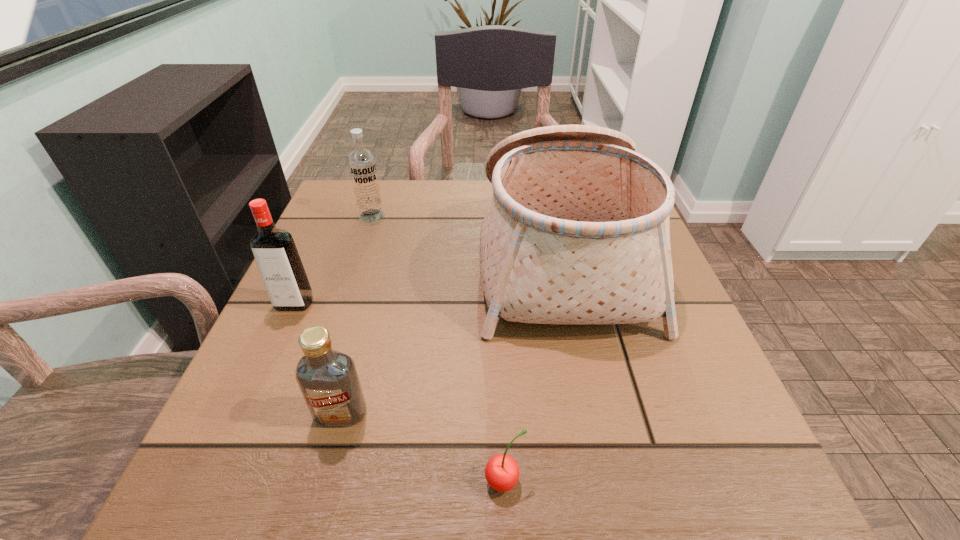
In order to click on free space located 0.060m with the lid open on the tallest object in this screenshot , I will do `click(452, 256)`.

This screenshot has width=960, height=540. I want to click on vacant space located 0.280m on the front and back of the leftmost object, so click(x=226, y=457).

The height and width of the screenshot is (540, 960). I want to click on vacant space located on the front label of the farthest vodka, so click(x=349, y=282).

The width and height of the screenshot is (960, 540). In order to click on free space located on the front-facing side of the second shortest object in this screenshot , I will do `click(318, 498)`.

Find the location of a particular element. This screenshot has width=960, height=540. blank space located 0.280m on the left of the cherry is located at coordinates tap(275, 481).

Locate an element on the screen. basket that is at the far edge is located at coordinates (577, 231).

Find the location of a particular element. This screenshot has height=540, width=960. vodka that is at the far edge is located at coordinates (362, 165).

Find the location of `object situated at the near edge`. object situated at the near edge is located at coordinates (502, 473).

Identify the location of object present at the right edge. Image resolution: width=960 pixels, height=540 pixels. (577, 231).

The height and width of the screenshot is (540, 960). What are the coordinates of `object located in the far left corner section of the desktop` in the screenshot? It's located at (362, 165).